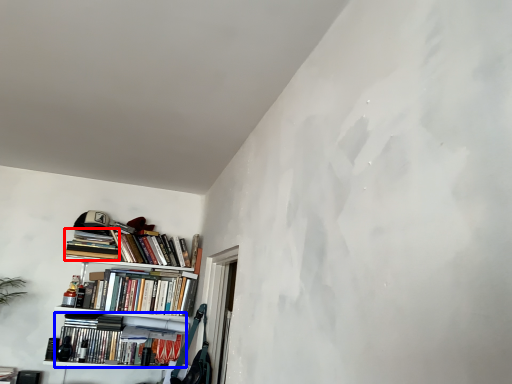
Question: Which of the following is the farthest to the observer, book (highlighted by a red box) or book (highlighted by a blue box)?

Choices:
 (A) book
 (B) book

Answer: (A)